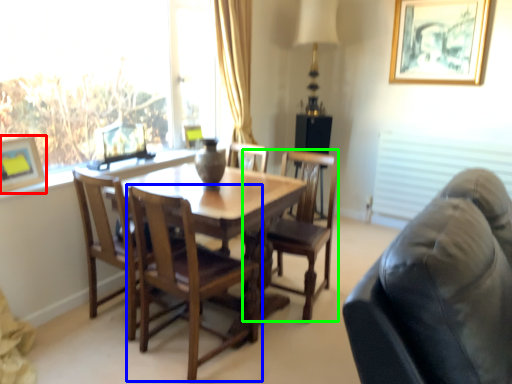
Question: Which object is the closest to the picture frame (highlighted by a red box)? Choose among these: chair (highlighted by a blue box) or chair (highlighted by a green box).

Choices:
 (A) chair
 (B) chair

Answer: (A)